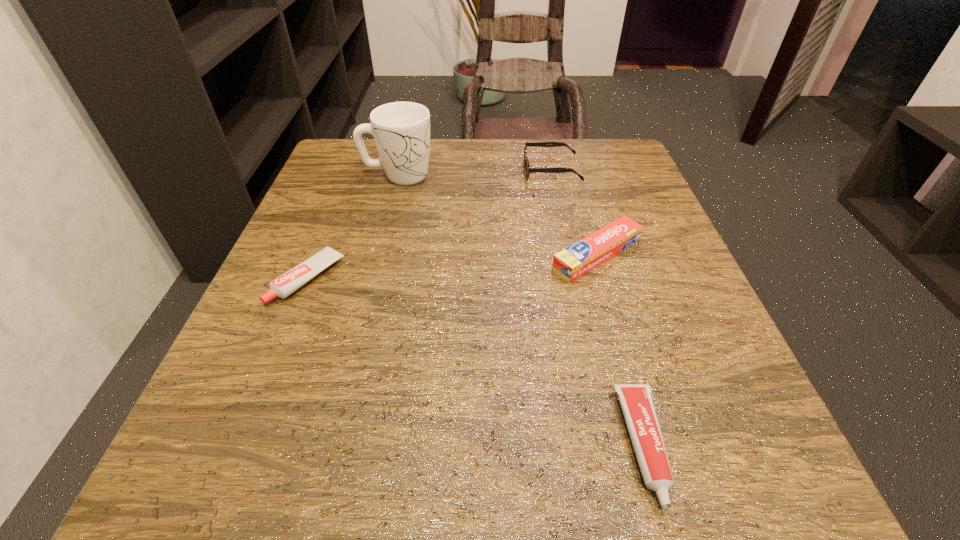
The height and width of the screenshot is (540, 960). I want to click on empty space that is in between the leftmost toothpaste and the sunglasses, so point(430,225).

Locate an element on the screen. Image resolution: width=960 pixels, height=540 pixels. free space between the leftmost toothpaste and the nearest object is located at coordinates (476, 362).

At what (x,y) coordinates should I click in order to perform the action: click on object that is the second closest to the mug. Please return your answer as a coordinate pair (x, y). Looking at the image, I should click on (283, 286).

Identify which object is the third closest to the nearest toothpaste. Please provide its 2D coordinates. Your answer should be formatted as a tuple, i.e. [(x, y)], where the tuple contains the x and y coordinates of a point satisfying the conditions above.

[(528, 169)]

Image resolution: width=960 pixels, height=540 pixels. I want to click on toothpaste that is the closest to the nearest toothpaste, so click(574, 261).

Point out which toothpaste is positioned as the third nearest to the mug. Please provide its 2D coordinates. Your answer should be formatted as a tuple, i.e. [(x, y)], where the tuple contains the x and y coordinates of a point satisfying the conditions above.

[(636, 401)]